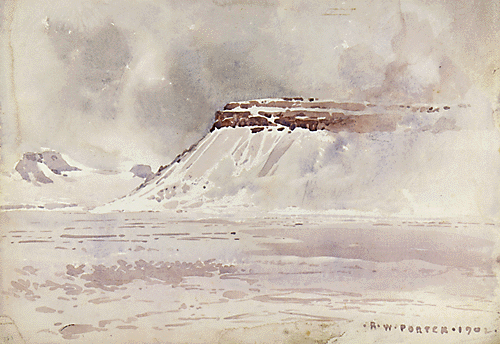
At what (x,y) coordinates should I click in order to perform the action: click on painting. Please return your answer as a coordinate pair (x, y). The image size is (500, 344). Looking at the image, I should click on (438, 241).